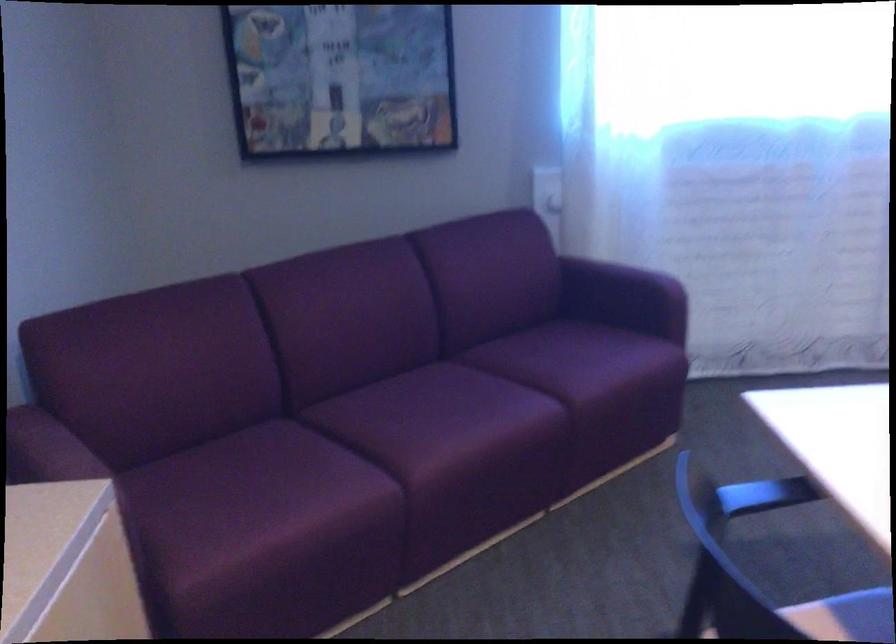
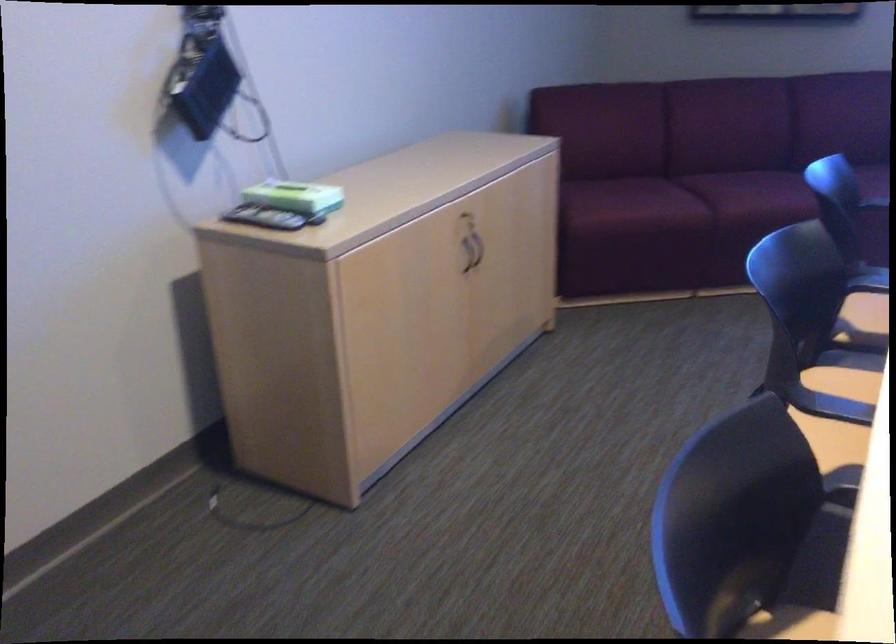
Find the pixel in the second image that matches [429,442] in the first image.

(745, 198)